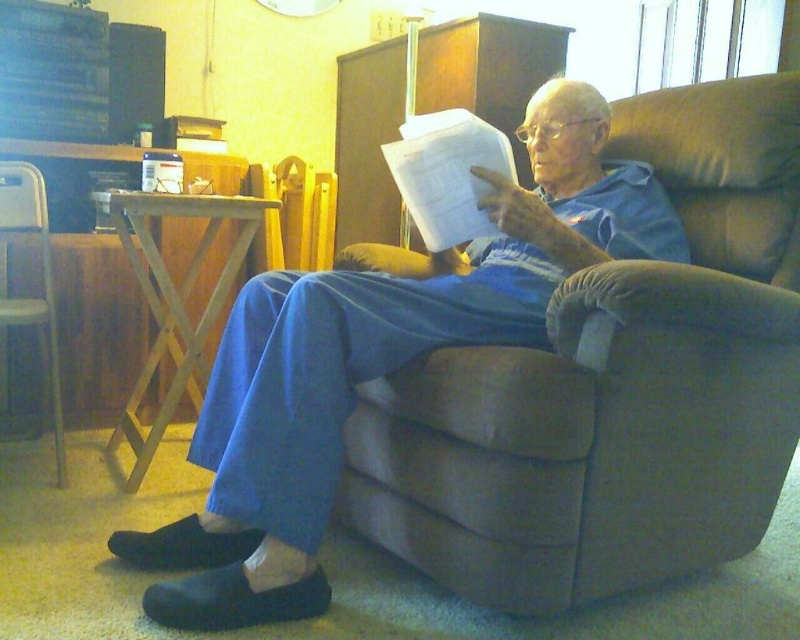
You are a tailor measuring the blue cotton pants at center and the metallic silver chair at left for a customer. The customer wants to know if the pants are wider than the chair. Can you confirm?

The blue cotton pants at center are wider than the metallic silver chair at left according to the measurements.

You are a home assistant and need to retrieve an item from under the metallic silver chair at left. Can you reach the blue cotton pants at center without moving the chair?

The blue cotton pants at center is positioned under the metallic silver chair at left, so yes, you can reach the blue cotton pants at center without moving the chair.